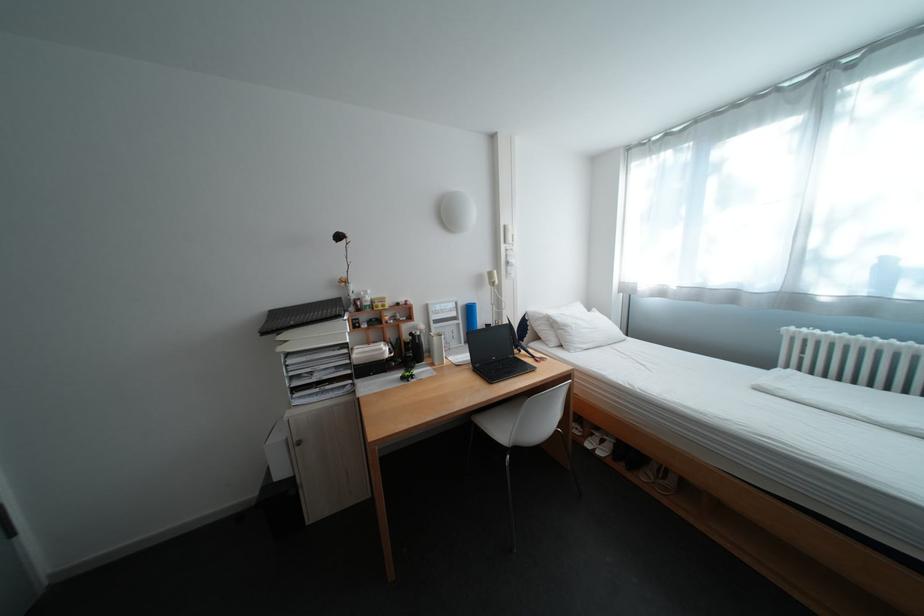
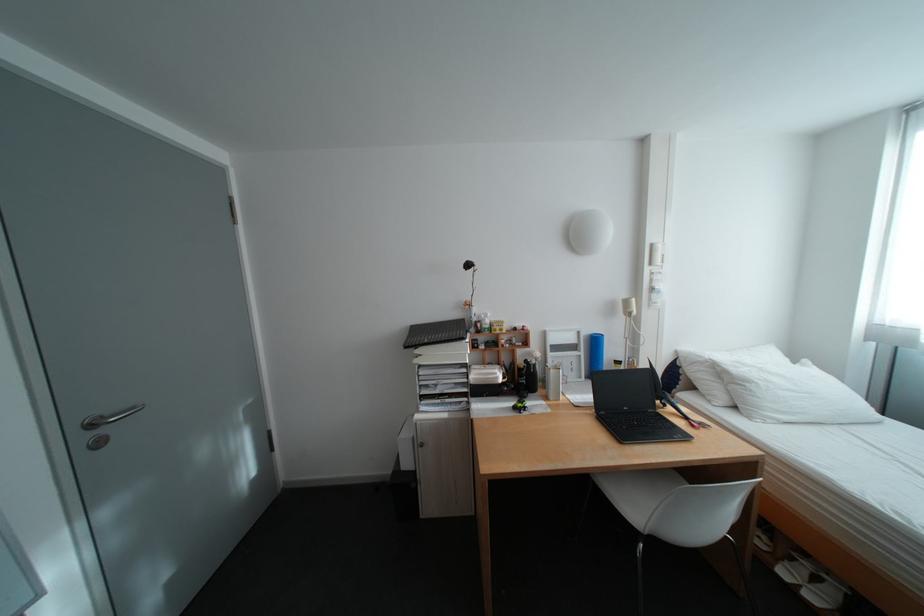
In the second image, find the point that corresponds to point 406,355 in the first image.

(518, 381)